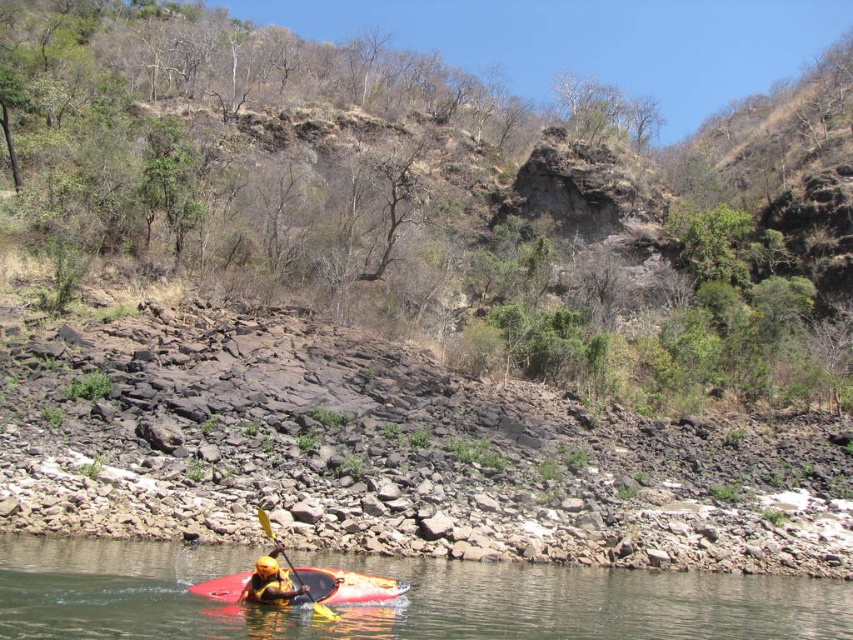
You are a photographer standing at the edge of the water and want to capture both the point at coordinates point (160, 412) and point (312, 586) in your shot. Which point should you focus on first to ensure both are in the frame?

You should focus on point (160, 412) first because it is closer to the camera than point (312, 586), ensuring both points are within the frame.

You are the kayaker in the red kayak. You notice the rocky at lower center and the yellow matte helmet at lower center. Which object is closer to the water surface?

The yellow matte helmet at lower center is closer to the water surface because the rocky at lower center is located above it, meaning the helmet is positioned lower.